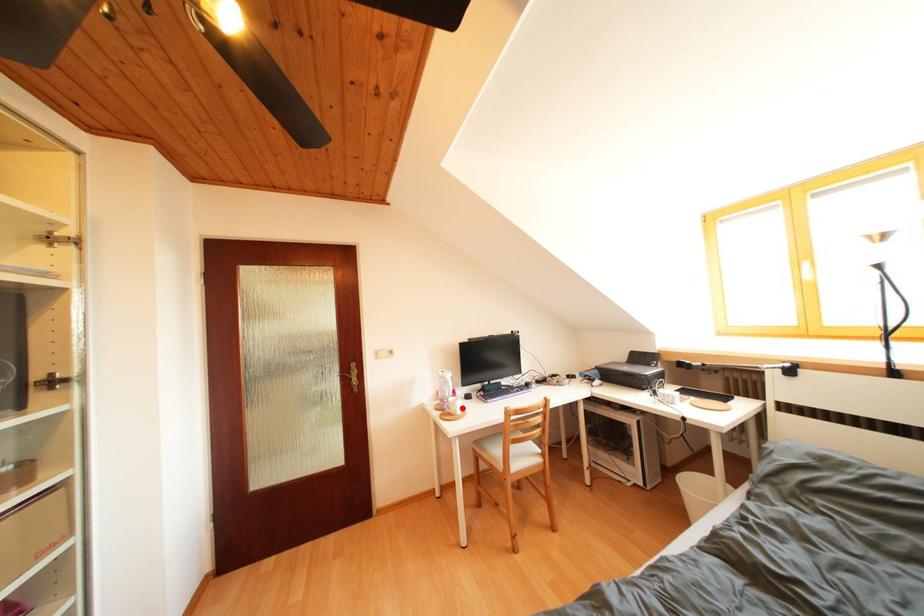
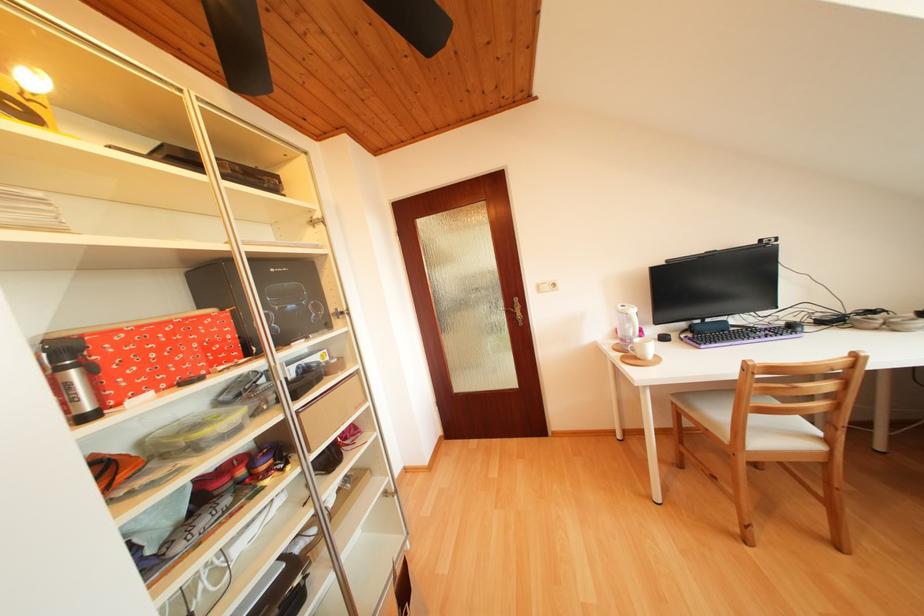
Question: I am providing you with two images of the same scene from different viewpoints. In image1, a red point is highlighted. Considering the same 3D point in image2, which of the following is correct?

Choices:
 (A) It is closer
 (B) It is farther

Answer: (A)